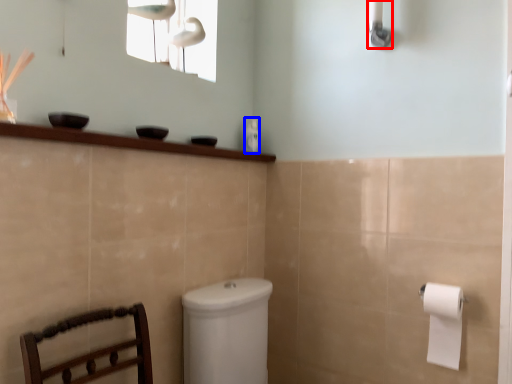
Question: Which object is closer to the camera taking this photo, shower (highlighted by a red box) or toiletry (highlighted by a blue box)?

Choices:
 (A) shower
 (B) toiletry

Answer: (A)